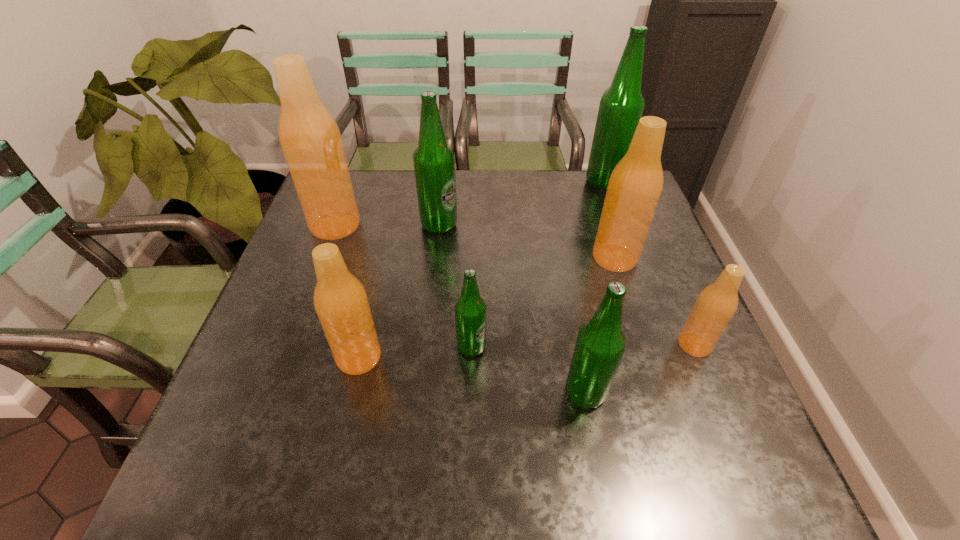
Identify the location of the rightmost green beer bottle. Image resolution: width=960 pixels, height=540 pixels. (621, 106).

Identify the location of the farthest green beer bottle. (621, 106).

You are a GUI agent. You are given a task and a screenshot of the screen. Output one action in this format:
    pyautogui.click(x=<x>, y=<y>)
    Task: Click on the leftmost tan beer bottle
    This screenshot has height=540, width=960.
    Given the screenshot: What is the action you would take?
    pyautogui.click(x=309, y=136)

Where is `the leftmost beer bottle`? This screenshot has width=960, height=540. the leftmost beer bottle is located at coordinates (309, 136).

Find the location of `the leftmost green beer bottle`. the leftmost green beer bottle is located at coordinates (434, 163).

The height and width of the screenshot is (540, 960). In order to click on the sixth beer bottle from right to left in this screenshot , I will do `click(434, 163)`.

Where is `the second tan beer bottle from right to left`? The width and height of the screenshot is (960, 540). the second tan beer bottle from right to left is located at coordinates (635, 185).

This screenshot has width=960, height=540. I want to click on the fourth farthest object, so click(x=635, y=185).

Where is `the second smallest tan beer bottle`? Image resolution: width=960 pixels, height=540 pixels. the second smallest tan beer bottle is located at coordinates (340, 300).

Identify the location of the third tan beer bottle from right to left. (340, 300).